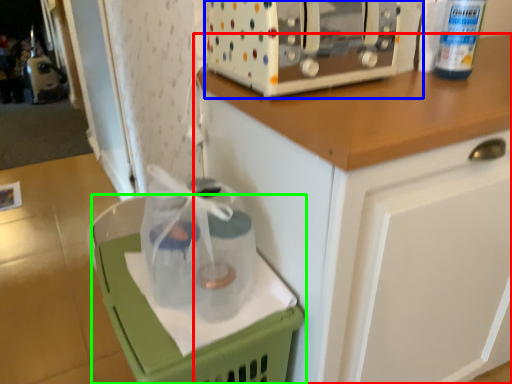
Question: Based on their relative distances, which object is farther from cabinetry (highlighted by a red box)? Choose from home appliance (highlighted by a blue box) and basket (highlighted by a green box).

Choices:
 (A) home appliance
 (B) basket

Answer: (B)